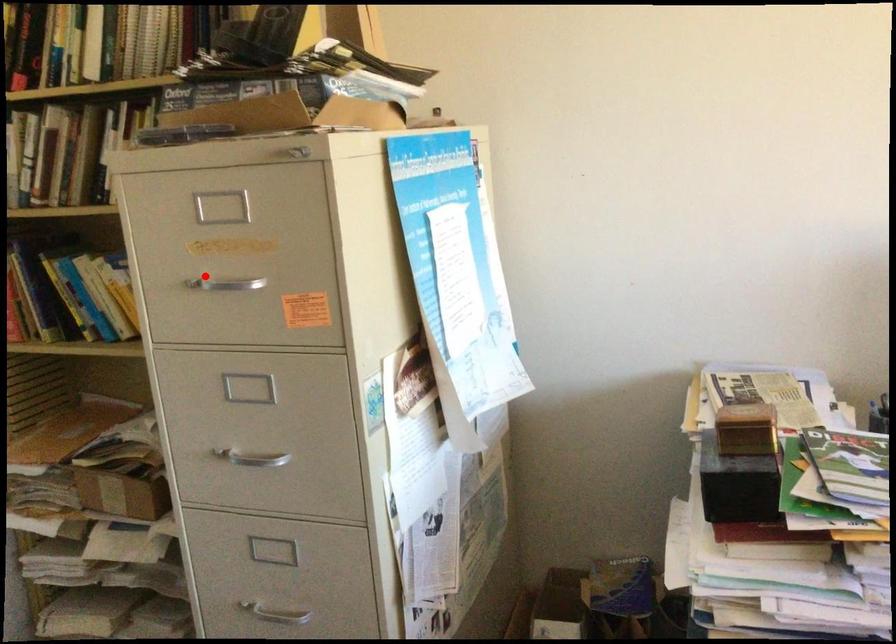
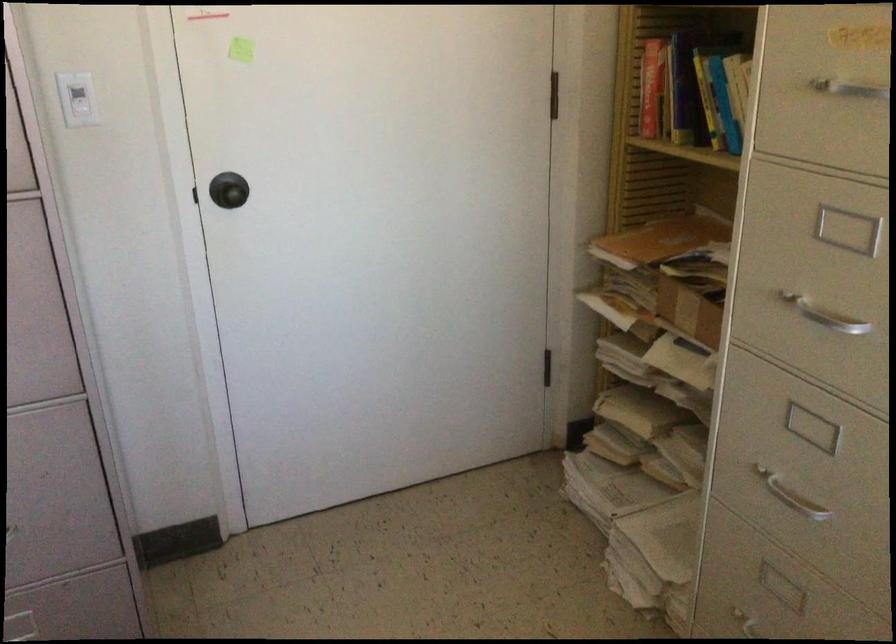
Where in the second image is the point corresponding to the highlighted location from the first image?

(839, 82)